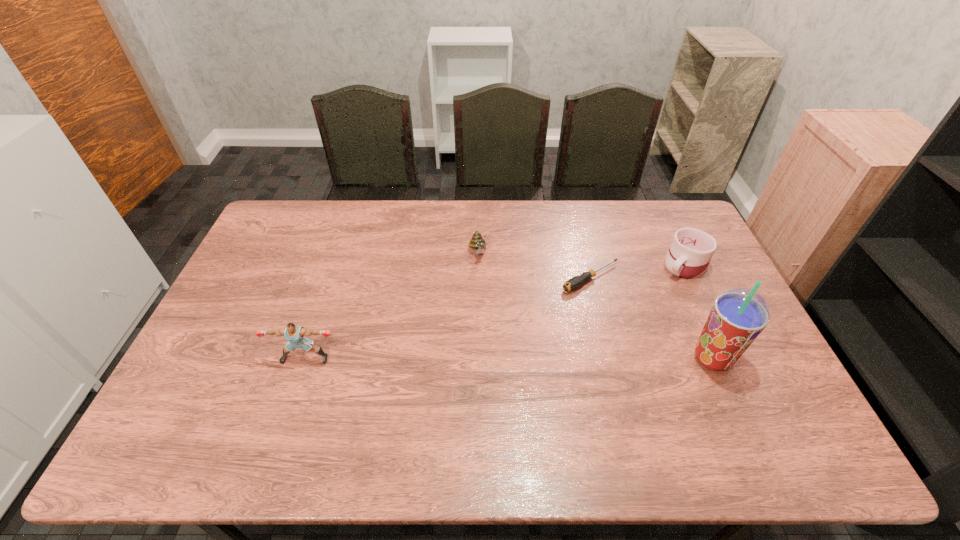
Find the location of a particular element. The image size is (960, 540). free region located at the tip of the third object from right to left is located at coordinates (528, 309).

Identify the location of free location located 0.160m at the tip of the third object from right to left. This screenshot has width=960, height=540. (528, 309).

This screenshot has width=960, height=540. Find the location of `free location located 0.230m on the face of the fourth object from right to left`. free location located 0.230m on the face of the fourth object from right to left is located at coordinates (497, 316).

Identify the location of vacant space located on the face of the fourth object from right to left. (x=493, y=304).

The height and width of the screenshot is (540, 960). I want to click on vacant space positioned 0.080m on the face of the fourth object from right to left, so click(486, 281).

Locate an element on the screen. This screenshot has height=540, width=960. vacant area situated 0.280m on the side with the handle of the mug is located at coordinates (619, 318).

Find the location of a particular element. The image size is (960, 540). free space located 0.080m on the side with the handle of the mug is located at coordinates (658, 287).

At what (x,y) coordinates should I click in order to perform the action: click on vacant space located 0.170m on the side with the handle of the mug. Please return your answer as a coordinate pair (x, y). Image resolution: width=960 pixels, height=540 pixels. Looking at the image, I should click on (641, 301).

This screenshot has width=960, height=540. Identify the location of smoothie situated at the right edge. (739, 315).

Identify the location of mug located at the right edge. Image resolution: width=960 pixels, height=540 pixels. (691, 250).